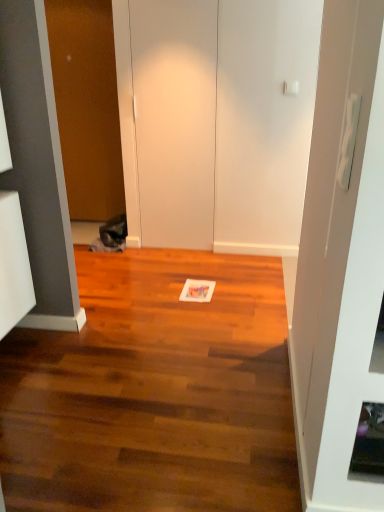
Question: Which direction should I rotate to look at white matte door at center, the second door positioned from the left?

Choices:
 (A) right
 (B) left

Answer: (B)

Question: From a real-world perspective, is white matte door at center, the second door positioned from the left, beneath wooden door at left, placed as the first door when sorted from left to right?

Choices:
 (A) no
 (B) yes

Answer: (B)

Question: Does white matte door at center, marked as the 1th door in a right-to-left arrangement, have a lesser height compared to wooden door at left, placed as the first door when sorted from left to right?

Choices:
 (A) no
 (B) yes

Answer: (B)

Question: Considering the relative sizes of white matte door at center, the second door positioned from the left, and wooden door at left, placed as the first door when sorted from left to right, in the image provided, is white matte door at center, the second door positioned from the left, smaller than wooden door at left, placed as the first door when sorted from left to right,?

Choices:
 (A) no
 (B) yes

Answer: (B)

Question: Is white matte door at center, the second door positioned from the left, surrounding wooden door at left, which is counted as the 2th door, starting from the right?

Choices:
 (A) no
 (B) yes

Answer: (A)

Question: From the image's perspective, is white matte door at center, marked as the 1th door in a right-to-left arrangement, on wooden door at left, placed as the first door when sorted from left to right?

Choices:
 (A) yes
 (B) no

Answer: (B)

Question: Is white matte door at center, marked as the 1th door in a right-to-left arrangement, further to camera compared to wooden door at left, which is counted as the 2th door, starting from the right?

Choices:
 (A) yes
 (B) no

Answer: (B)

Question: Is wooden door at left, which is counted as the 2th door, starting from the right, behind white matte door at center, marked as the 1th door in a right-to-left arrangement?

Choices:
 (A) no
 (B) yes

Answer: (B)

Question: Does wooden door at left, which is counted as the 2th door, starting from the right, have a lesser height compared to white matte door at center, the second door positioned from the left?

Choices:
 (A) no
 (B) yes

Answer: (A)

Question: Would you say wooden door at left, placed as the first door when sorted from left to right, is a long distance from white matte door at center, marked as the 1th door in a right-to-left arrangement?

Choices:
 (A) yes
 (B) no

Answer: (B)

Question: From a real-world perspective, is wooden door at left, which is counted as the 2th door, starting from the right, under white matte door at center, the second door positioned from the left?

Choices:
 (A) yes
 (B) no

Answer: (B)

Question: Considering the relative sizes of wooden door at left, which is counted as the 2th door, starting from the right, and white matte door at center, the second door positioned from the left, in the image provided, is wooden door at left, which is counted as the 2th door, starting from the right, taller than white matte door at center, the second door positioned from the left,?

Choices:
 (A) yes
 (B) no

Answer: (A)

Question: Does wooden door at left, placed as the first door when sorted from left to right, come in front of white matte door at center, marked as the 1th door in a right-to-left arrangement?

Choices:
 (A) no
 (B) yes

Answer: (A)

Question: In terms of width, does white matte door at center, the second door positioned from the left, look wider or thinner when compared to wooden door at left, placed as the first door when sorted from left to right?

Choices:
 (A) thin
 (B) wide

Answer: (A)